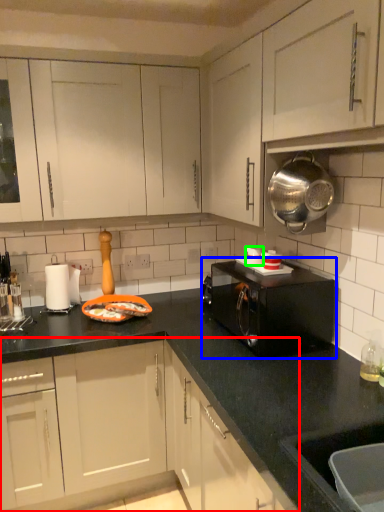
Question: Estimate the real-world distances between objects in this image. Which object is closer to cabinetry (highlighted by a red box), microwave oven (highlighted by a blue box) or appliance (highlighted by a green box)?

Choices:
 (A) microwave oven
 (B) appliance

Answer: (A)